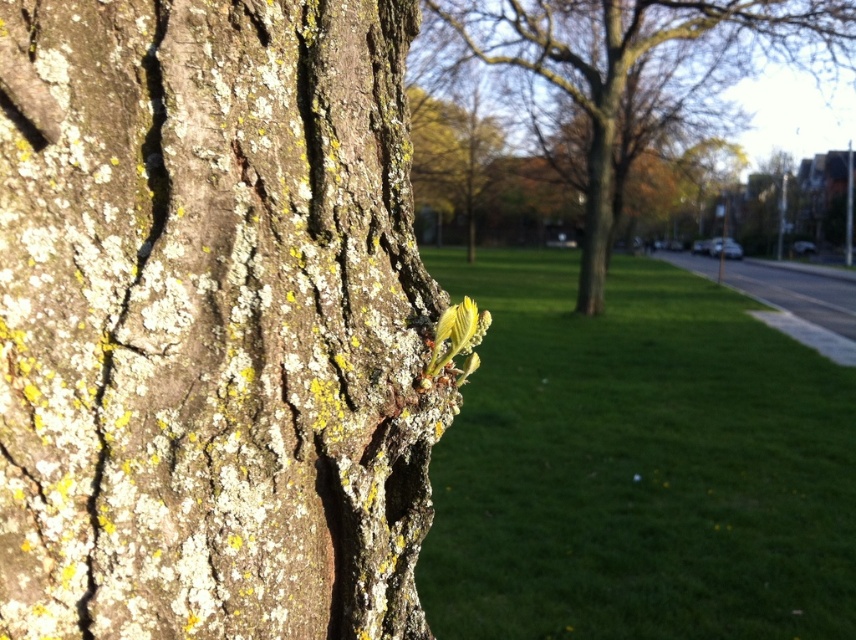
Question: Which point is closer to the camera?

Choices:
 (A) green grass at center
 (B) green lichen-covered tree trunk at center

Answer: (A)

Question: Which point is closer to the camera?

Choices:
 (A) (593, 58)
 (B) (68, 77)

Answer: (B)

Question: Which of these objects is positioned closest to the cracked bark tree trunk at center?

Choices:
 (A) green lichen-covered tree trunk at center
 (B) green grass at center

Answer: (B)

Question: Can you confirm if cracked bark tree trunk at center is smaller than smooth bark tree at center?

Choices:
 (A) no
 (B) yes

Answer: (B)

Question: Is cracked bark tree trunk at center bigger than green lichen-covered tree trunk at center?

Choices:
 (A) no
 (B) yes

Answer: (A)

Question: Where is green grass at center located in relation to green lichen-covered tree trunk at center in the image?

Choices:
 (A) below
 (B) above

Answer: (A)